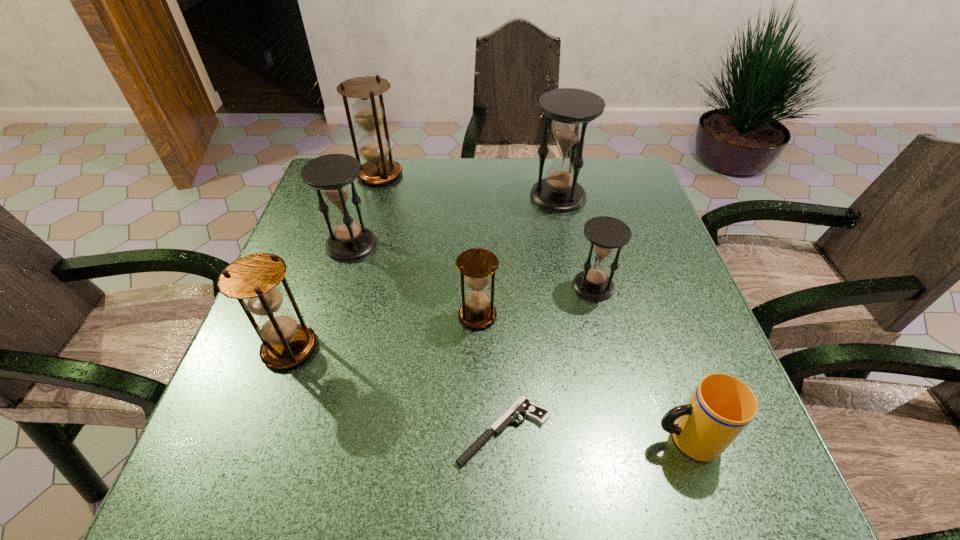
Locate an element on the screen. Image resolution: width=960 pixels, height=540 pixels. vacant space that is in between the second biggest brown hourglass and the farthest brown hourglass is located at coordinates (335, 261).

This screenshot has width=960, height=540. In order to click on vacant space that's between the second shortest object and the biggest brown hourglass in this screenshot , I will do `click(533, 306)`.

You are a GUI agent. You are given a task and a screenshot of the screen. Output one action in this format:
    pyautogui.click(x=<x>, y=<y>)
    Task: Click on the vacant area between the smallest brown hourglass and the second shortest object
    
    Given the screenshot: What is the action you would take?
    pyautogui.click(x=582, y=377)

Find the location of a particular element. vacant space in between the third hourglass from right to left and the farthest brown hourglass is located at coordinates (x=428, y=245).

This screenshot has height=540, width=960. I want to click on empty location between the biggest black hourglass and the shortest object, so pyautogui.click(x=531, y=314).

Image resolution: width=960 pixels, height=540 pixels. Find the location of `object that is the second closest to the second shortest object`. object that is the second closest to the second shortest object is located at coordinates (605, 233).

Locate an element on the screen. object that is the second nearest to the second shortest object is located at coordinates (605, 233).

Where is `the sixth closest hourglass to the shortest object`? The image size is (960, 540). the sixth closest hourglass to the shortest object is located at coordinates (374, 147).

This screenshot has width=960, height=540. What are the coordinates of `hourglass that is the fifth closest one to the cup` in the screenshot? It's located at (332, 175).

Identify which black hourglass is the second closest to the smallest brown hourglass. Please provide its 2D coordinates. Your answer should be formatted as a tuple, i.e. [(x, y)], where the tuple contains the x and y coordinates of a point satisfying the conditions above.

[(332, 175)]